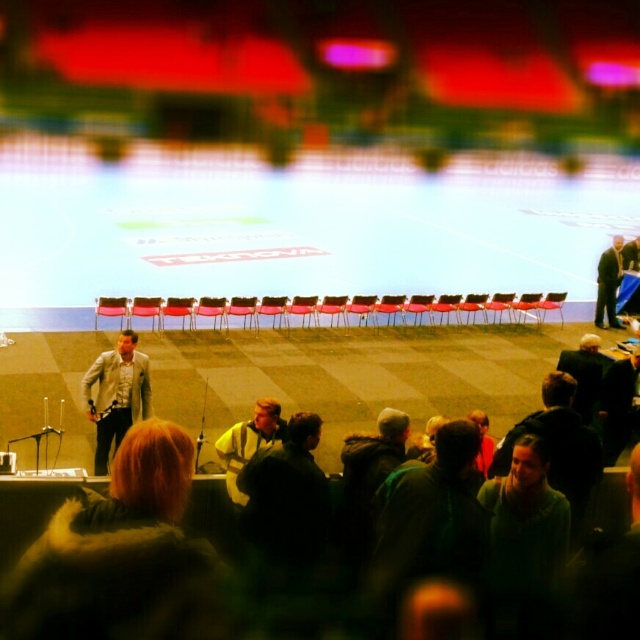
Question: Is yellow-green safety vest at center above dark gray suit at right?

Choices:
 (A) yes
 (B) no

Answer: (B)

Question: Which point is closer to the camera?

Choices:
 (A) dark gray jacket at right
 (B) light gray textured blazer at center
 (C) dark gray suit at right
 (D) yellow-green safety vest at center

Answer: (D)

Question: Is dark gray jacket at right wider than dark gray suit at right?

Choices:
 (A) no
 (B) yes

Answer: (B)

Question: Is light gray textured blazer at center closer to camera compared to yellow-green safety vest at center?

Choices:
 (A) yes
 (B) no

Answer: (B)

Question: Which point is closer to the camera taking this photo?

Choices:
 (A) (608, 257)
 (B) (608, 358)

Answer: (B)

Question: Which of the following is the closest to the observer?

Choices:
 (A) dark gray jacket at right
 (B) light gray textured blazer at center
 (C) dark gray suit at right
 (D) yellow-green safety vest at center

Answer: (D)